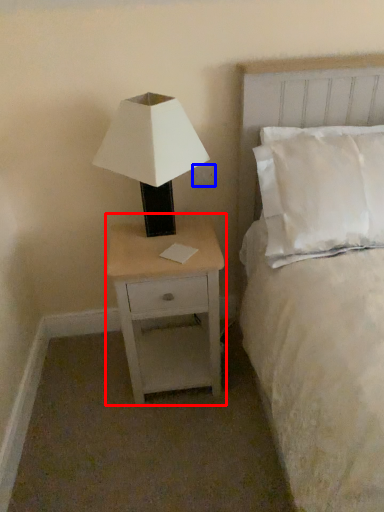
Question: Among these objects, which one is nearest to the camera, nightstand (highlighted by a red box) or electric outlet (highlighted by a blue box)?

Choices:
 (A) nightstand
 (B) electric outlet

Answer: (A)